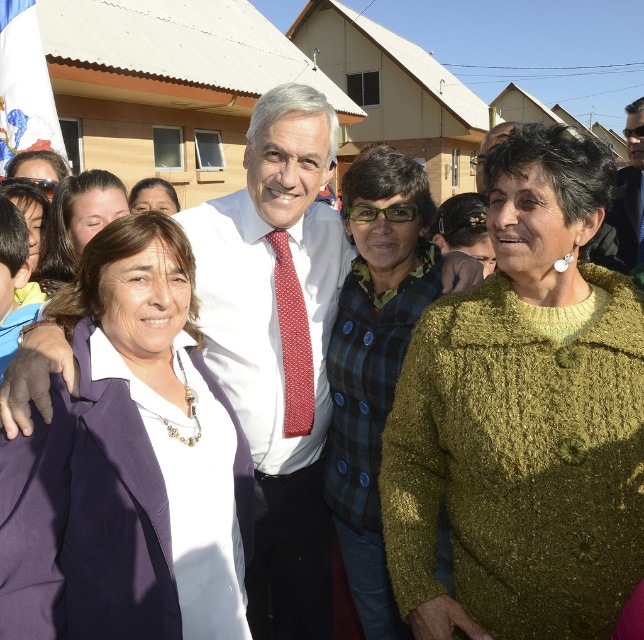
You are taking a photo of the scene described. If you want to focus on the white shirt at center and the matte black hair at upper left, which one should you adjust your camera to prioritize focusing on first?

The white shirt at center should be prioritized for focusing first because it is positioned under the matte black hair at upper left, meaning it is closer to the camera.

You are a photographer standing 5 feet away from the group. You want to take a closeup shot of the purple fabric jacket at left and the red dotted tie at center. Can you fit both subjects into your camera frame if your camera has a maximum field of view of 4 feet?

The purple fabric jacket at left and red dotted tie at center are 3.55 feet apart, so yes, the photographer can fit both subjects into the camera frame since the distance between them is within the 4 feet maximum field of view.

You are a photographer adjusting your camera settings to capture the group photo. You need to ensure both the purple fabric jacket at left and the red dotted tie at center are in focus. Considering their sizes, which object should you prioritize focusing on first to ensure clarity?

The purple fabric jacket at left is wider than the red dotted tie at center. Since it is larger, you should prioritize focusing on the purple fabric jacket at left first to ensure its details are clear before adjusting for the smaller red dotted tie at center.